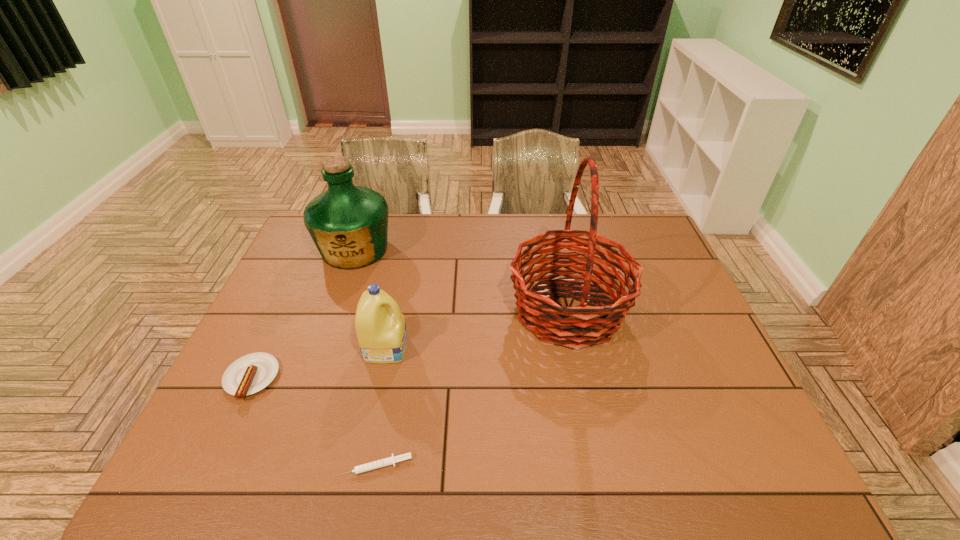
Identify the location of object that is the third nearest to the rightmost object. pos(349,224).

Identify the location of free space that satisfies the following two spatial constraints: 1. on the front side of the syringe; 2. on the right side of the sausage. (210, 466).

Locate an element on the screen. This screenshot has width=960, height=540. blank area in the image that satisfies the following two spatial constraints: 1. on the label side of the syringe; 2. on the right side of the fourth shortest object is located at coordinates (279, 466).

Identify the location of free space that satisfies the following two spatial constraints: 1. on the back side of the nearest object; 2. on the label of the detergent. (396, 347).

Find the location of a particular element. The height and width of the screenshot is (540, 960). free spot that satisfies the following two spatial constraints: 1. on the label of the syringe; 2. on the right side of the detergent is located at coordinates (362, 466).

The width and height of the screenshot is (960, 540). I want to click on vacant space that satisfies the following two spatial constraints: 1. on the front side of the basket; 2. on the label of the detergent, so click(576, 347).